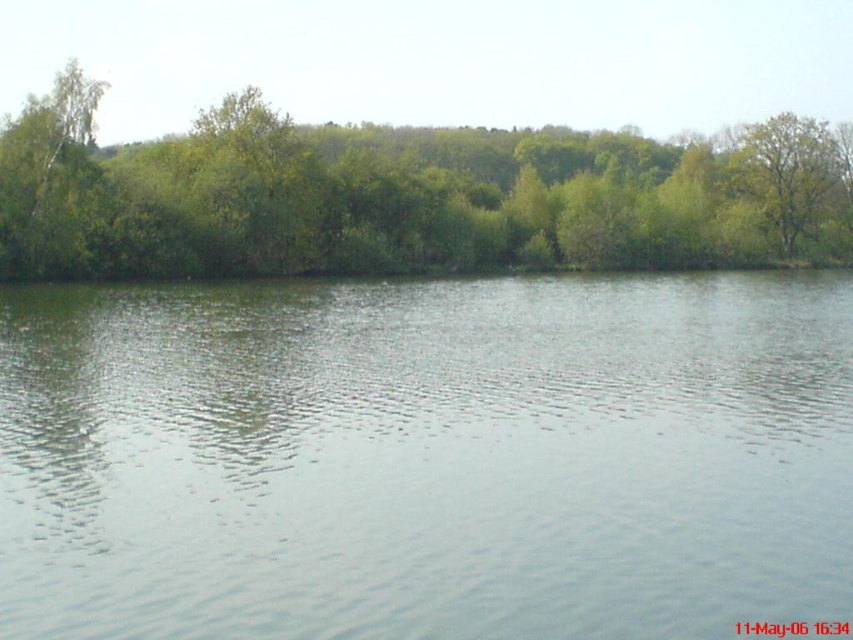
Find the location of a particular element. This screenshot has height=640, width=853. green leafy tree at upper center is located at coordinates (405, 195).

Is point (189, 204) positioned before point (776, 177)?

Yes, point (189, 204) is closer to viewer.

This screenshot has height=640, width=853. What are the coordinates of `green leafy tree at upper center` in the screenshot? It's located at (405, 195).

Consider the image. Can you confirm if clear water at center is positioned to the left of green leafy tree at upper center?

Incorrect, clear water at center is not on the left side of green leafy tree at upper center.

Who is lower down, clear water at center or green leafy tree at upper center?

clear water at center

Find the location of a particular element. The width and height of the screenshot is (853, 640). clear water at center is located at coordinates (426, 458).

Does clear water at center appear on the left side of green leafy tree at upper right?

Yes, clear water at center is to the left of green leafy tree at upper right.

Does clear water at center appear on the right side of green leafy tree at upper right?

In fact, clear water at center is to the left of green leafy tree at upper right.

What do you see at coordinates (426, 458) in the screenshot?
I see `clear water at center` at bounding box center [426, 458].

Where is `clear water at center`? Image resolution: width=853 pixels, height=640 pixels. clear water at center is located at coordinates (426, 458).